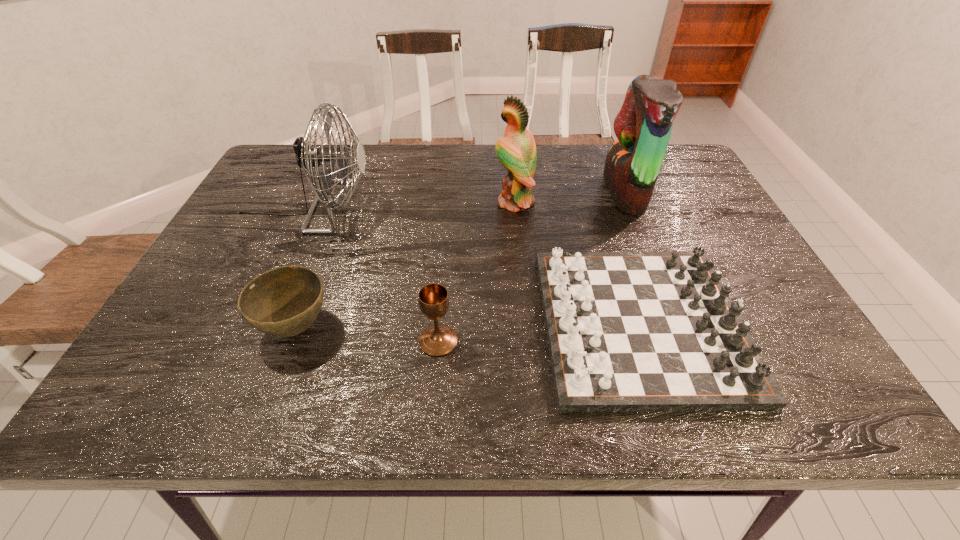
You are a GUI agent. You are given a task and a screenshot of the screen. Output one action in this format:
    pyautogui.click(x=<x>, y=<y>)
    Task: Click on the right parrot
    The image size is (960, 540).
    Given the screenshot: What is the action you would take?
    pyautogui.click(x=643, y=126)

This screenshot has width=960, height=540. Identify the location of the left parrot. (517, 152).

You are a GUI agent. You are given a task and a screenshot of the screen. Output one action in this format:
    pyautogui.click(x=<x>, y=<y>)
    Task: Click on the fan
    The height and width of the screenshot is (540, 960).
    Given the screenshot: What is the action you would take?
    coord(307,158)

What are the coordinates of `chalice` in the screenshot? It's located at (438, 340).

Locate an element on the screen. the fourth tallest object is located at coordinates (438, 340).

At what (x,y) coordinates should I click in order to perform the action: click on bowl. Please return your answer as a coordinate pair (x, y). Looking at the image, I should click on (285, 301).

Image resolution: width=960 pixels, height=540 pixels. I want to click on chessboard, so click(x=627, y=331).

Locate an element on the screen. Image resolution: width=960 pixels, height=540 pixels. vacant area located at the face of the right parrot is located at coordinates (516, 192).

This screenshot has width=960, height=540. Identify the location of vacant area situated at the face of the right parrot. (528, 192).

You are a GUI agent. You are given a task and a screenshot of the screen. Output one action in this format:
    pyautogui.click(x=<x>, y=<y>)
    Task: Click on the blank space located 0.330m at the face of the right parrot
    Image resolution: width=960 pixels, height=540 pixels.
    Given the screenshot: What is the action you would take?
    pyautogui.click(x=489, y=192)